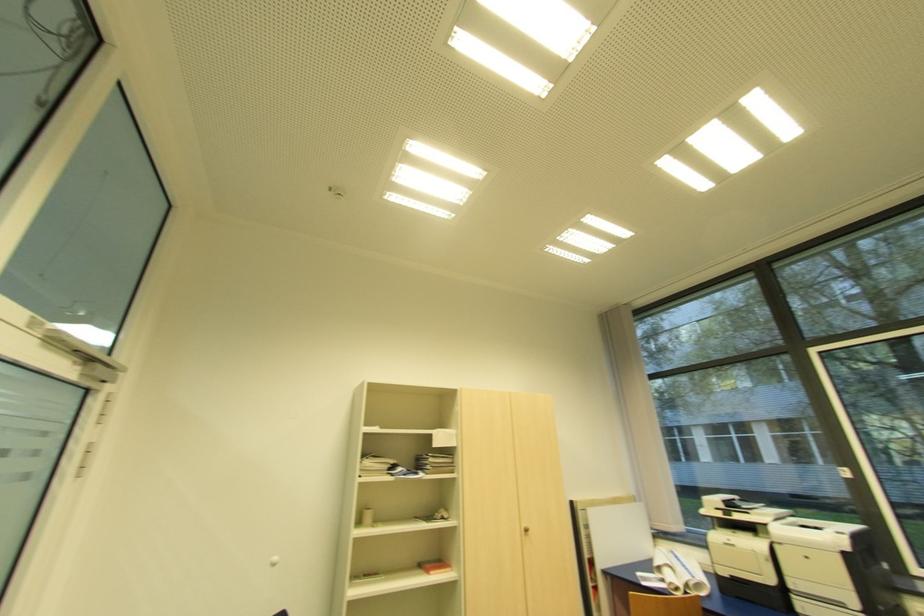
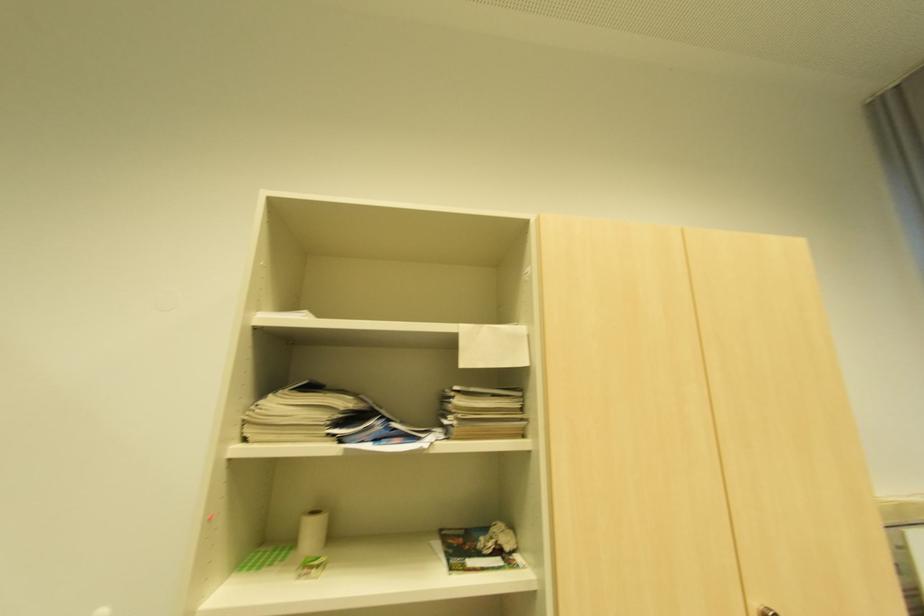
Question: What movement of the cameraman would produce the second image?

Choices:
 (A) Left
 (B) Right
 (C) Forward
 (D) Backward

Answer: (C)